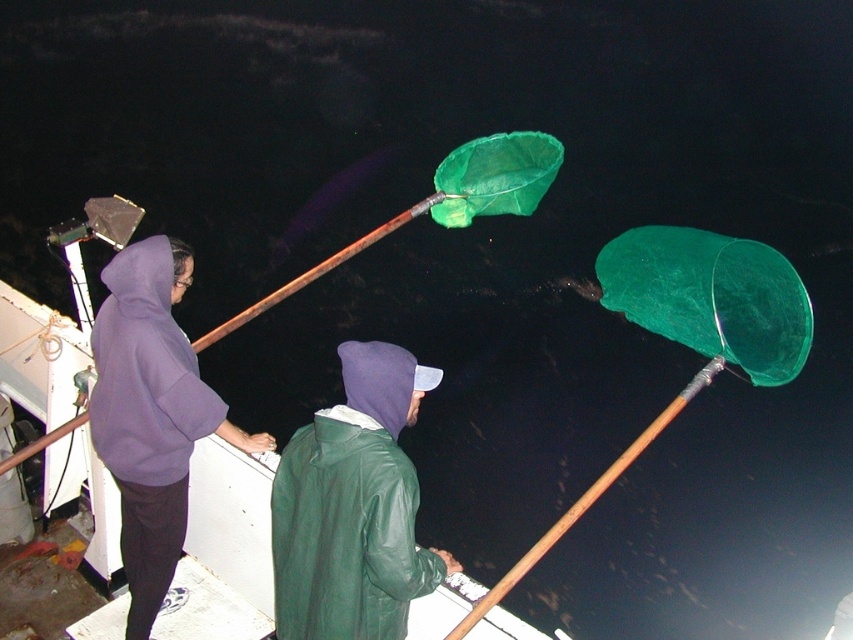
Is point (276, 625) less distant than point (347, 252)?

Yes, point (276, 625) is closer to viewer.

This screenshot has width=853, height=640. What are the coordinates of `green matte jacket at center` in the screenshot? It's located at (352, 508).

Is point (285, 522) positioned before point (0, 461)?

Yes, point (285, 522) is closer to viewer.

Locate an element on the screen. The image size is (853, 640). green matte jacket at center is located at coordinates (352, 508).

Is purple hoodie at left wider than wooden pole at upper center?

In fact, purple hoodie at left might be narrower than wooden pole at upper center.

Consider the image. Who is more distant from viewer, (236, 445) or (708, 364)?

The point (236, 445) is more distant.

Who is more forward, (144, 556) or (500, 588)?

Positioned in front is point (500, 588).

Where is `purple hoodie at left`? This screenshot has width=853, height=640. purple hoodie at left is located at coordinates (151, 413).

Does green matte jacket at center have a lesser height compared to purple hoodie at left?

Yes, green matte jacket at center is shorter than purple hoodie at left.

Does green matte jacket at center appear on the left side of purple hoodie at left?

In fact, green matte jacket at center is to the right of purple hoodie at left.

Who is more forward, (370, 630) or (202, 400)?

Point (370, 630)

This screenshot has height=640, width=853. I want to click on green matte jacket at center, so click(x=352, y=508).